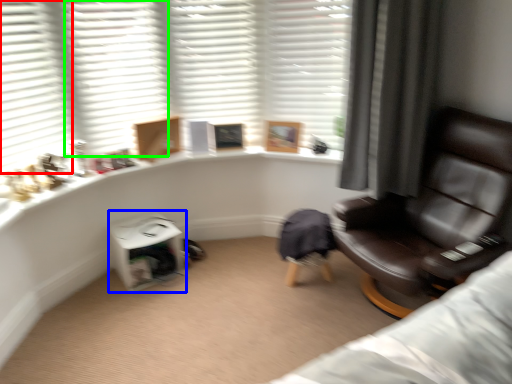
Question: Considering the real-world distances, which object is closest to shutter (highlighted by a red box)? table (highlighted by a blue box) or shutter (highlighted by a green box).

Choices:
 (A) table
 (B) shutter

Answer: (B)